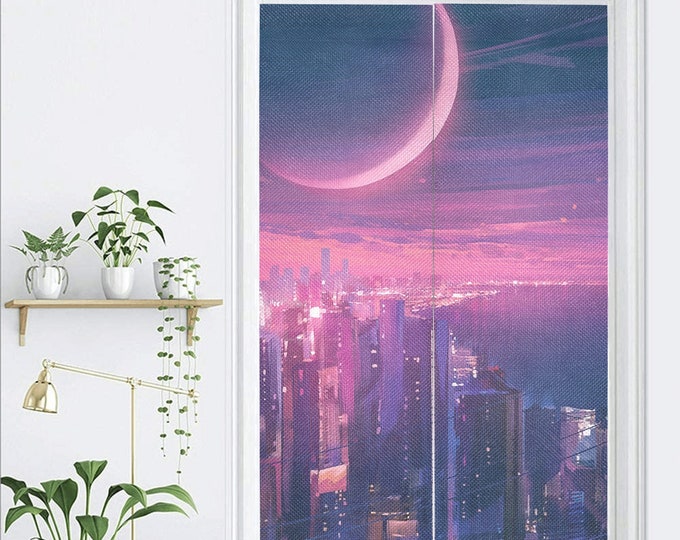
At what (x,y) coordinates should I click in order to perform the action: click on white ceramic pots. Please return your answer as a coordinate pair (x, y). The width and height of the screenshot is (680, 540). Looking at the image, I should click on pos(52,287), pos(118,284), pos(179,284).